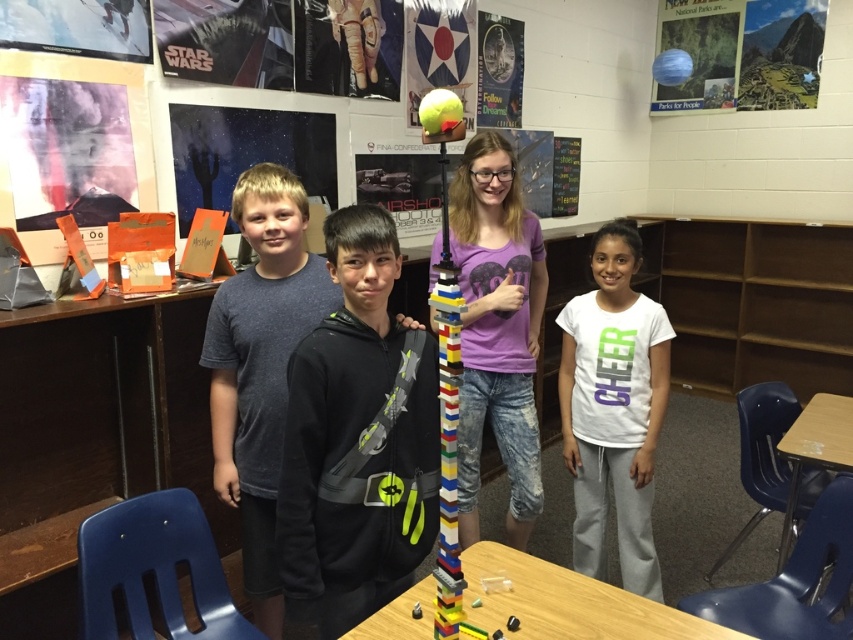
Question: Which point is closer to the camera taking this photo?

Choices:
 (A) (357, 332)
 (B) (810, 432)
 (C) (643, 332)

Answer: (A)

Question: Which of these objects is positioned farthest from the white cotton shirt at center?

Choices:
 (A) black fleece hoodie at center
 (B) wooden table at center
 (C) dark gray t-shirt at center
 (D) wooden table at lower right

Answer: (C)

Question: Is dark gray t-shirt at center below wooden table at center?

Choices:
 (A) yes
 (B) no

Answer: (B)

Question: Which point is closer to the camera?

Choices:
 (A) (799, 456)
 (B) (624, 300)
 (C) (372, 628)

Answer: (C)

Question: Does purple matte shirt at center have a larger size compared to wooden table at center?

Choices:
 (A) no
 (B) yes

Answer: (B)

Question: Is black fleece hoodie at center to the right of wooden table at lower right from the viewer's perspective?

Choices:
 (A) no
 (B) yes

Answer: (A)